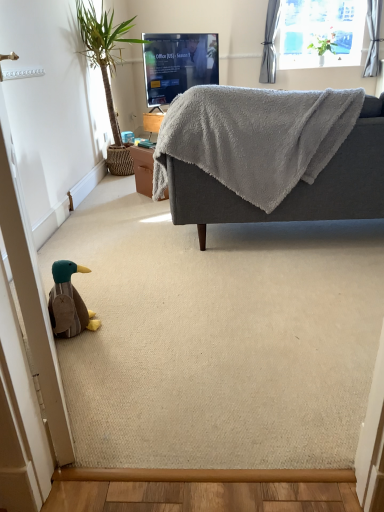
Question: From the image's perspective, relative to matte black tv at upper center, is gray fabric curtain at upper right above or below?

Choices:
 (A) above
 (B) below

Answer: (A)

Question: Considering the positions of gray fabric curtain at upper right and matte black tv at upper center in the image, is gray fabric curtain at upper right bigger or smaller than matte black tv at upper center?

Choices:
 (A) big
 (B) small

Answer: (B)

Question: Which object is positioned farthest from the green leafy plant at left?

Choices:
 (A) matte black tv at upper center
 (B) transparent glass window at upper center
 (C) gray fabric curtain at upper right
 (D) green leafy plant at upper right
 (E) brown plush duck at lower left

Answer: (D)

Question: Based on their relative distances, which object is farther from the gray fabric curtain at upper right?

Choices:
 (A) green leafy plant at left
 (B) matte black tv at upper center
 (C) green leafy plant at upper right
 (D) brown plush duck at lower left
 (E) gray soft fabric couch at upper right

Answer: (D)